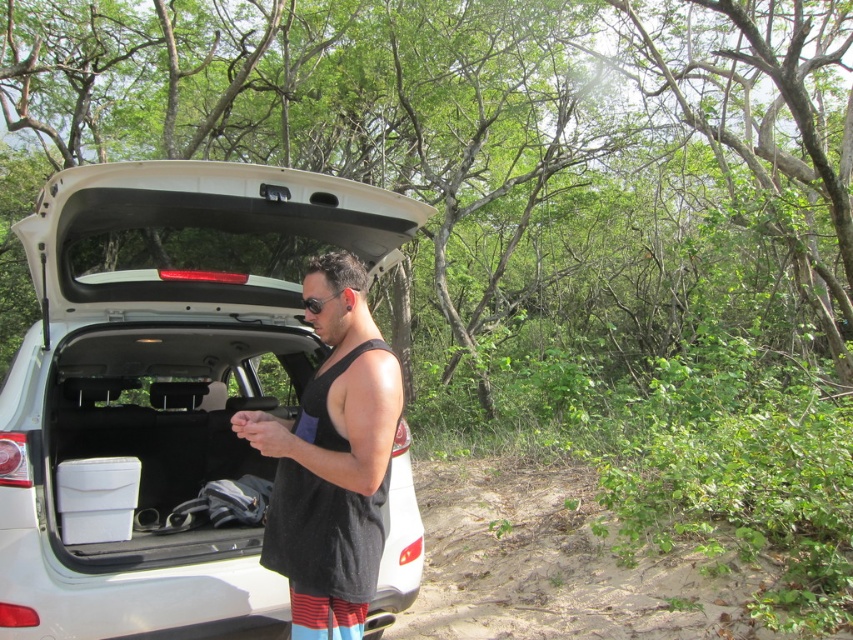
Does white matte car trunk at center have a greater height compared to black mesh tank top at center?

Yes.

Looking at this image, how much distance is there between white matte car trunk at center and black mesh tank top at center?

1.05 meters

At what (x,y) coordinates should I click in order to perform the action: click on white matte car trunk at center. Please return your answer as a coordinate pair (x, y). This screenshot has height=640, width=853. Looking at the image, I should click on (161, 388).

Locate an element on the screen. The width and height of the screenshot is (853, 640). white matte car trunk at center is located at coordinates (161, 388).